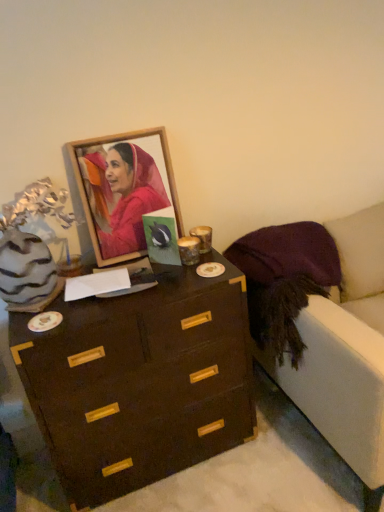
Question: From the image's perspective, is dark wood chest of drawers at center located above or below wooden frame at upper center?

Choices:
 (A) above
 (B) below

Answer: (B)

Question: Is dark wood chest of drawers at center in front of or behind wooden frame at upper center in the image?

Choices:
 (A) behind
 (B) front

Answer: (B)

Question: Estimate the real-world distances between objects in this image. Which object is farther from the wooden frame at upper center?

Choices:
 (A) dark wood chest of drawers at center
 (B) velvet purple armchair at right

Answer: (B)

Question: Considering the real-world distances, which object is farthest from the wooden frame at upper center?

Choices:
 (A) dark wood chest of drawers at center
 (B) velvet purple armchair at right

Answer: (B)